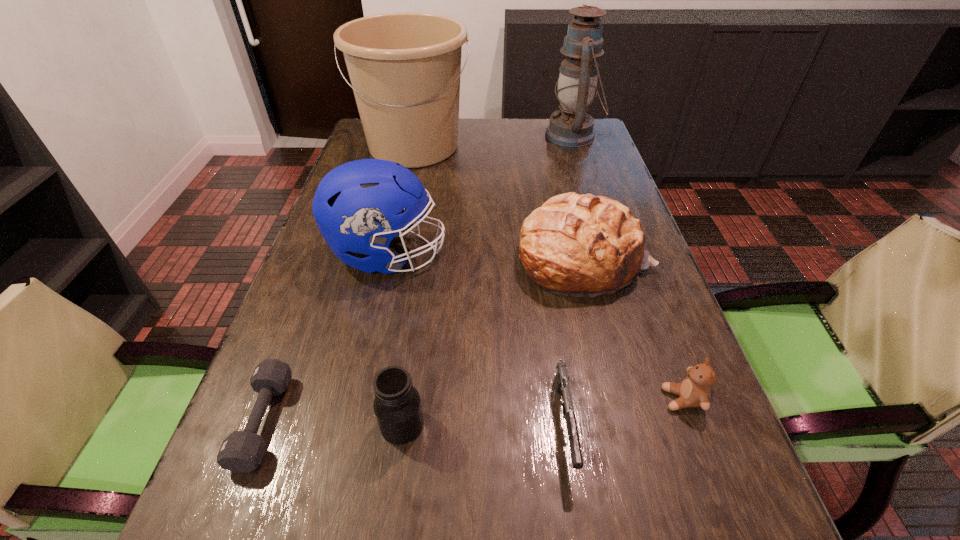
Locate which object ranks sixth in proximity to the oil lamp. Please provide its 2D coordinates. Your answer should be formatted as a tuple, i.e. [(x, y)], where the tuple contains the x and y coordinates of a point satisfying the conditions above.

[(397, 406)]

Locate which object is the seventh closest to the gun. Please provide its 2D coordinates. Your answer should be formatted as a tuple, i.e. [(x, y)], where the tuple contains the x and y coordinates of a point satisfying the conditions above.

[(572, 127)]